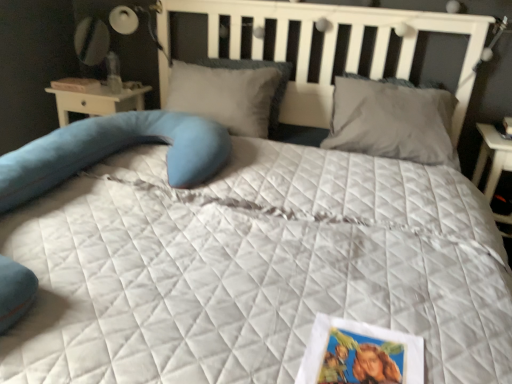
Question: Can you confirm if white paper book at upper left is wider than soft gray pillow at center, the first pillow from the left?

Choices:
 (A) no
 (B) yes

Answer: (A)

Question: Considering the relative sizes of white paper book at upper left and soft gray pillow at center, placed as the 2th pillow when sorted from right to left, in the image provided, is white paper book at upper left bigger than soft gray pillow at center, placed as the 2th pillow when sorted from right to left,?

Choices:
 (A) yes
 (B) no

Answer: (B)

Question: Can you confirm if white paper book at upper left is thinner than soft gray pillow at center, placed as the 2th pillow when sorted from right to left?

Choices:
 (A) no
 (B) yes

Answer: (B)

Question: Is white paper book at upper left located outside soft gray pillow at center, the first pillow from the left?

Choices:
 (A) no
 (B) yes

Answer: (B)

Question: Is white paper book at upper left taller than soft gray pillow at center, placed as the 2th pillow when sorted from right to left?

Choices:
 (A) yes
 (B) no

Answer: (B)

Question: Does white paper book at upper left touch soft gray pillow at center, the first pillow from the left?

Choices:
 (A) no
 (B) yes

Answer: (A)

Question: From the image's perspective, does gray matte pillow at upper right, placed as the second pillow when sorted from left to right, appear lower than printed paper postcard at lower right?

Choices:
 (A) yes
 (B) no

Answer: (B)

Question: Considering the relative positions of gray matte pillow at upper right, the first pillow positioned from the right, and printed paper postcard at lower right in the image provided, is gray matte pillow at upper right, the first pillow positioned from the right, to the left of printed paper postcard at lower right from the viewer's perspective?

Choices:
 (A) no
 (B) yes

Answer: (A)

Question: Is gray matte pillow at upper right, the first pillow positioned from the right, thinner than printed paper postcard at lower right?

Choices:
 (A) no
 (B) yes

Answer: (A)

Question: From a real-world perspective, is gray matte pillow at upper right, placed as the second pillow when sorted from left to right, physically below printed paper postcard at lower right?

Choices:
 (A) no
 (B) yes

Answer: (A)

Question: Is the position of gray matte pillow at upper right, the first pillow positioned from the right, less distant than that of printed paper postcard at lower right?

Choices:
 (A) yes
 (B) no

Answer: (B)

Question: Is gray matte pillow at upper right, the first pillow positioned from the right, with printed paper postcard at lower right?

Choices:
 (A) no
 (B) yes

Answer: (A)

Question: Are soft gray pillow at center, placed as the 2th pillow when sorted from right to left, and white paper book at upper left located far from each other?

Choices:
 (A) no
 (B) yes

Answer: (A)